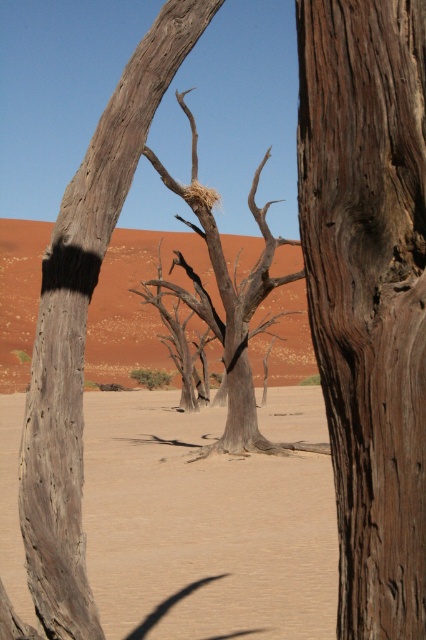
Question: Which point appears farthest from the camera in this image?

Choices:
 (A) (19, 365)
 (B) (380, 387)
 (C) (198, 282)
 (D) (132, 140)

Answer: (A)

Question: Which of the following is the closest to the observer?

Choices:
 (A) [206, 216]
 (B) [408, 280]

Answer: (B)

Question: Which object is positioned closest to the desert sand at center?

Choices:
 (A) dead brown tree at center
 (B) dark brown wood at center

Answer: (A)

Question: Is dark brown wood at center wider than rough bark tree at center?

Choices:
 (A) yes
 (B) no

Answer: (B)

Question: In this image, where is sandy beige desert at center located relative to dead brown tree at center?

Choices:
 (A) left
 (B) right

Answer: (A)

Question: Is dark brown wood at center to the right of sandy beige desert at center from the viewer's perspective?

Choices:
 (A) no
 (B) yes

Answer: (B)